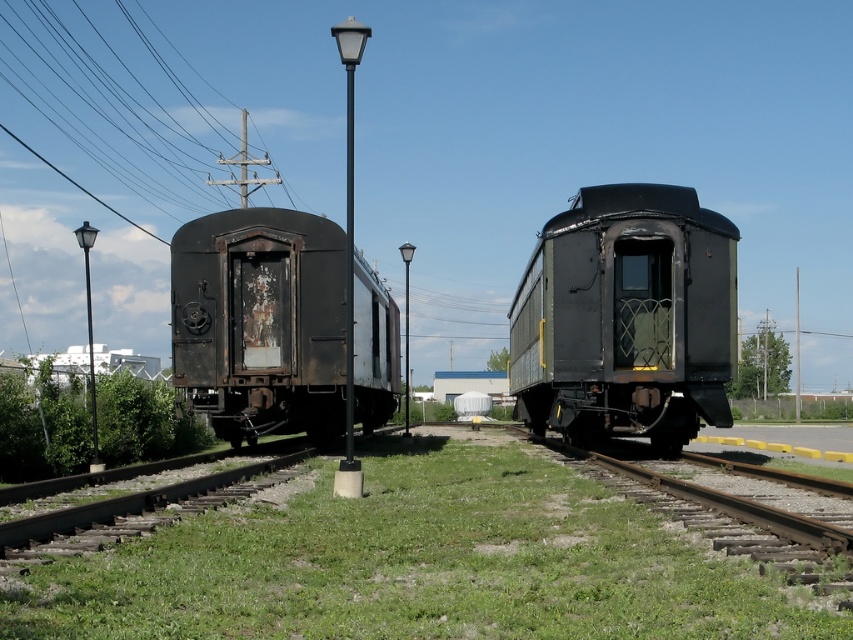
Based on the coordinates provided, where is the green grass at center located in the image?

The green grass at center is located at the 2D coordinates point [415,564].

You are a maintenance worker needing to walk between the two train cars. The path between them is covered by the green grass at center. Can you walk through the grass without stepping on the rusty metal train car at left?

The green grass at center is wider than the rusty metal train car at left, so yes, you can walk through the grass without stepping on the rusty metal train car at left.